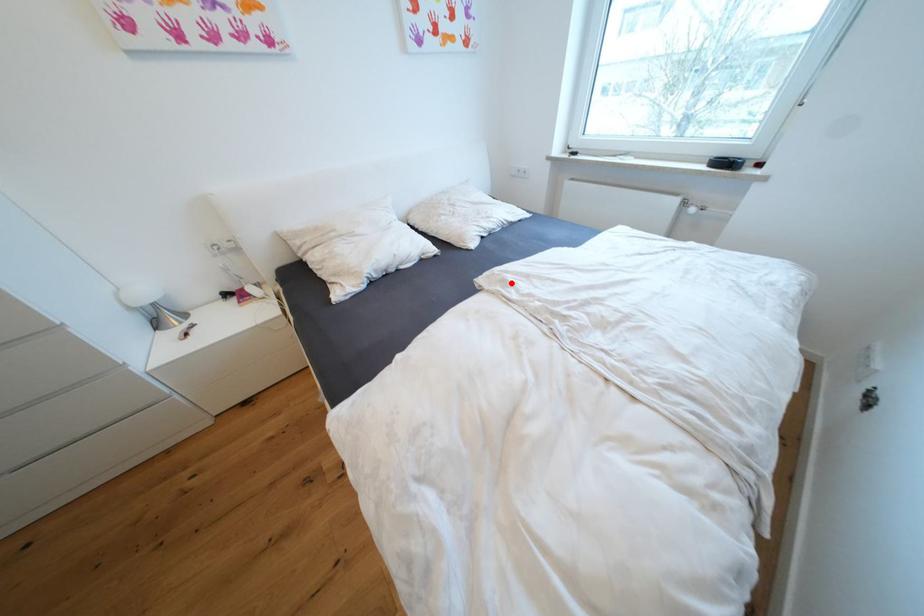
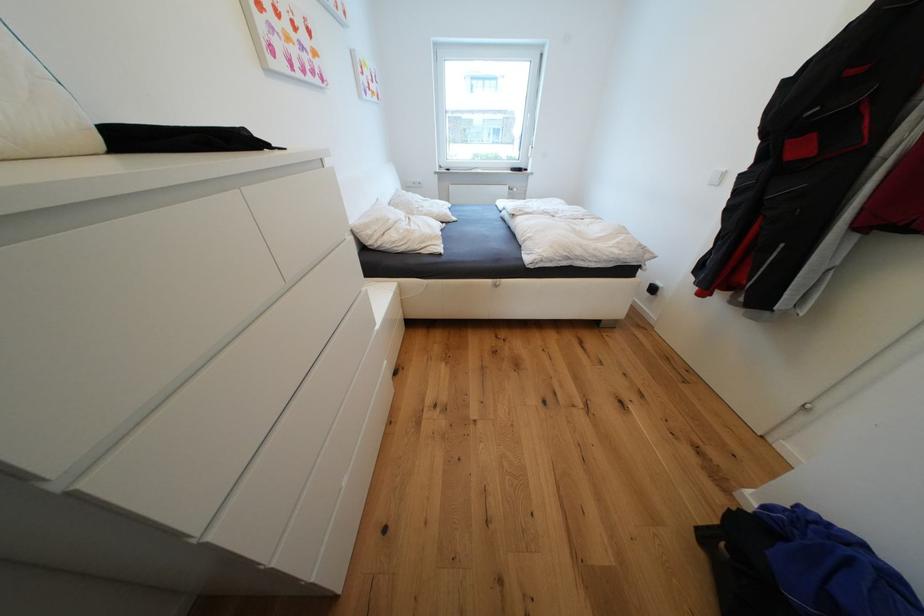
The point at the highlighted location is marked in the first image. Where is the corresponding point in the second image?

(528, 212)